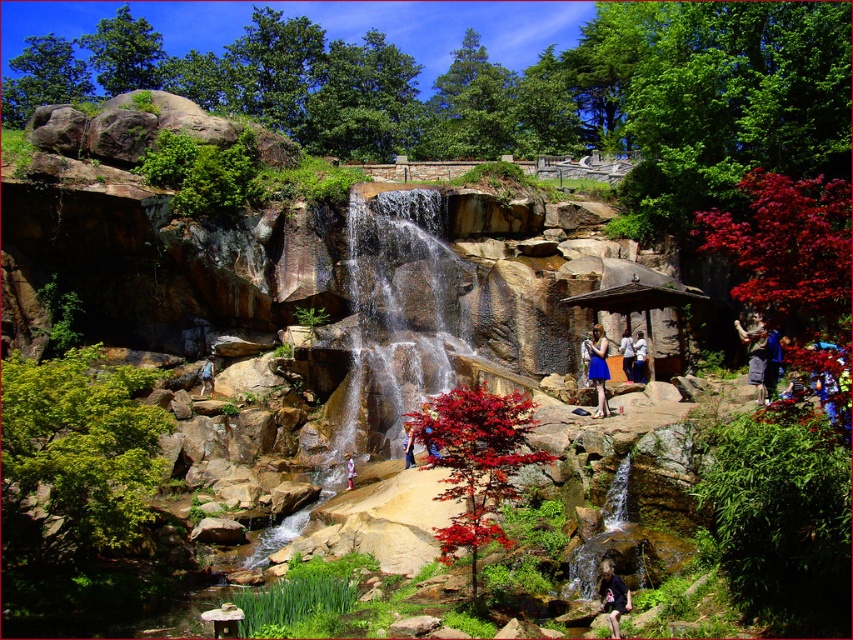
You are standing at the bottom of the waterfall in the scene. You see the blue fabric dress at center. In which direction should you walk to reach it?

The blue fabric dress at center is located at point 0.559 on the x axis and 0.750 on the y axis. Since you are at the bottom of the waterfall, which is likely at a lower y coordinate, you should walk upwards to increase your y coordinate to reach the dress.

You are a hiker who wants to place a small backpack between the blue denim jeans at right and the white cotton shirt at center. Based on their positions, which object should the backpack be closer to?

The blue denim jeans at right is closer to the viewer than the white cotton shirt at center, so the backpack should be placed closer to the white cotton shirt at center to maintain a balanced distance between both objects.